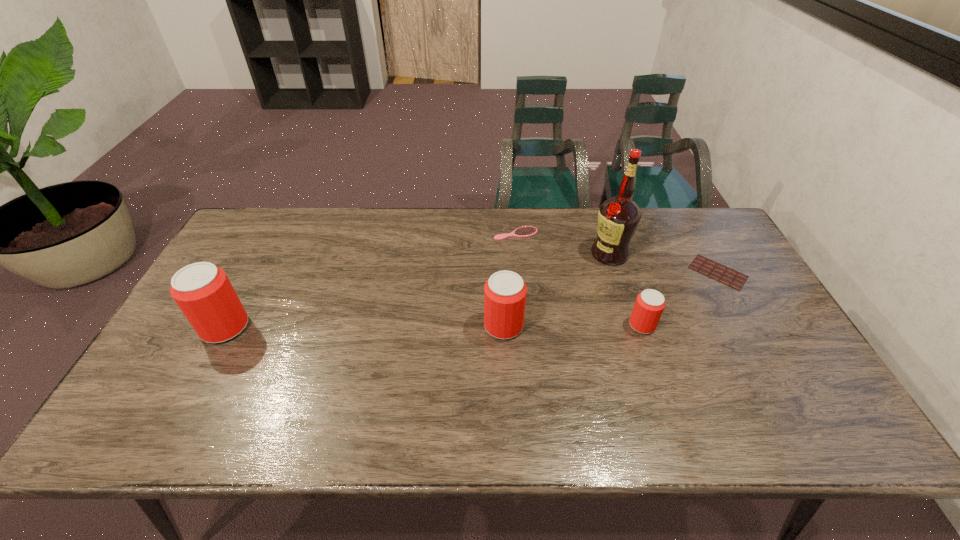
If the aim is uniform spacing by inserting an additional beer_can among them, please point to a vacant space for this new beer_can. Please provide its 2D coordinates. Your answer should be formatted as a tuple, i.e. [(x, y)], where the tuple contains the x and y coordinates of a point satisfying the conditions above.

[(365, 327)]